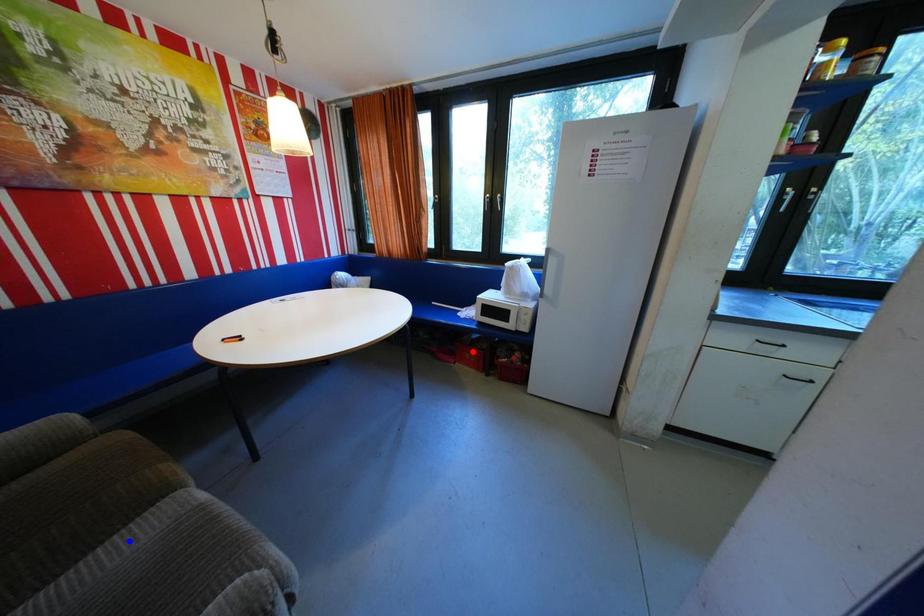
Question: In the image, two points are highlighted. Which point is nearer to the camera? Reply with the corresponding letter.

Choices:
 (A) blue point
 (B) red point

Answer: (A)